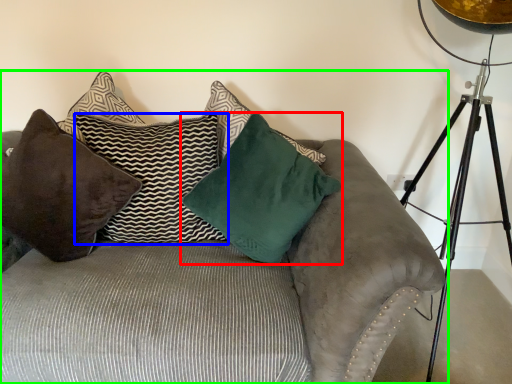
Question: Based on their relative distances, which object is nearer to pillow (highlighted by a red box)? Choose from pillow (highlighted by a blue box) and studio couch (highlighted by a green box).

Choices:
 (A) pillow
 (B) studio couch

Answer: (A)